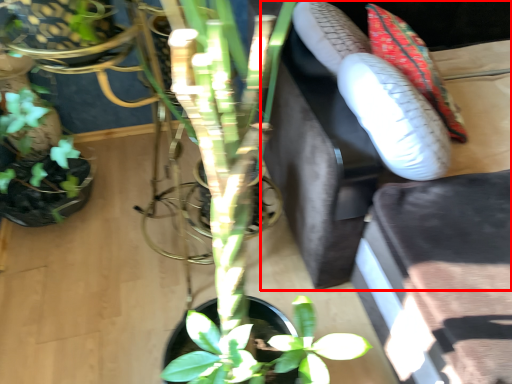
Question: From the image, what is the correct spatial relationship of couch (annotated by the red box) in relation to flower?

Choices:
 (A) right
 (B) left

Answer: (A)